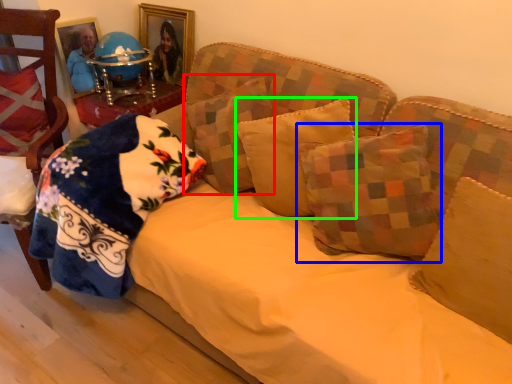
Question: Which is nearer to the pillow (highlighted by a red box)? pillow (highlighted by a blue box) or pillow (highlighted by a green box).

Choices:
 (A) pillow
 (B) pillow

Answer: (B)